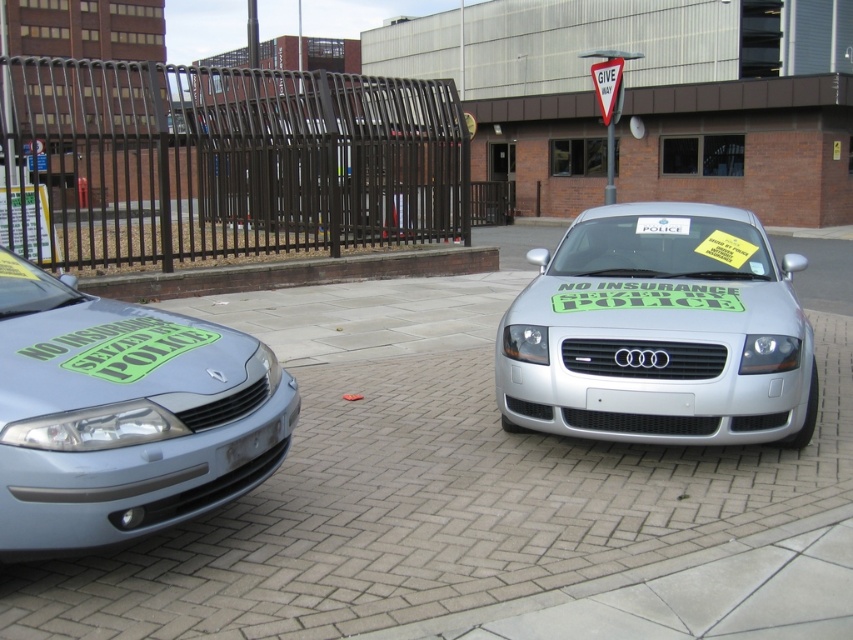
Question: Does green matte sticker at center have a greater width compared to white plastic sign at center?

Choices:
 (A) yes
 (B) no

Answer: (A)

Question: Which object is farther from the camera taking this photo?

Choices:
 (A) silver metallic car at center
 (B) brick paved at center
 (C) green matte sticker at center

Answer: (C)

Question: Is matte silver car at left smaller than white plastic triangle at upper center?

Choices:
 (A) no
 (B) yes

Answer: (A)

Question: Which object is farther from the camera taking this photo?

Choices:
 (A) silver metallic car at center
 (B) green matte sticker at center
 (C) matte silver car at left
 (D) brown concrete curb at center

Answer: (D)

Question: Among these objects, which one is nearest to the camera?

Choices:
 (A) white plastic sign at center
 (B) brick paved at center
 (C) brown concrete curb at center
 (D) matte silver car at left

Answer: (D)

Question: Is silver metallic car at center further to the viewer compared to green matte sticker at center?

Choices:
 (A) yes
 (B) no

Answer: (B)